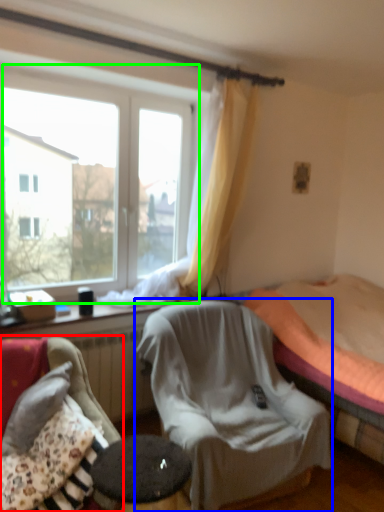
Question: Considering the real-world distances, which object is closest to chair (highlighted by a red box)? chair (highlighted by a blue box) or window (highlighted by a green box).

Choices:
 (A) chair
 (B) window

Answer: (A)